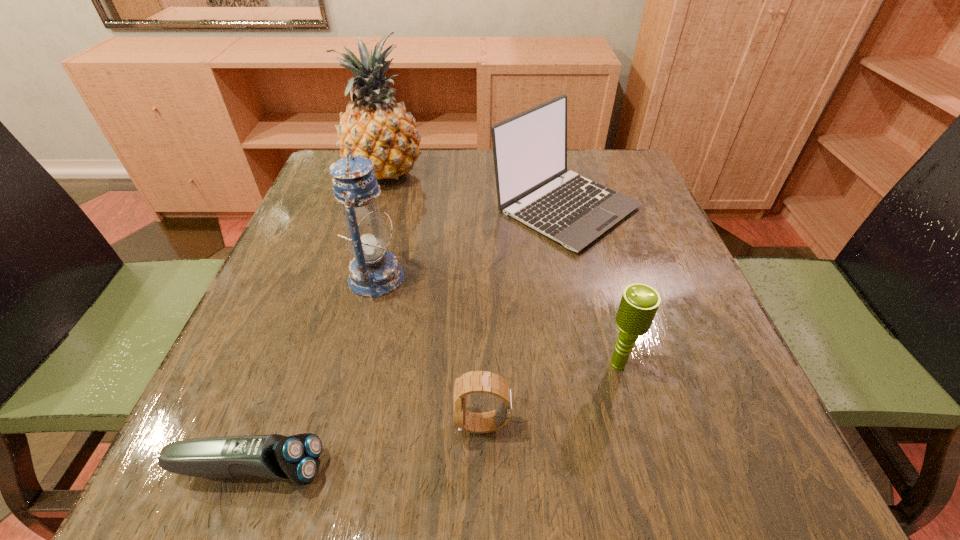
The image size is (960, 540). I want to click on free space that satisfies the following two spatial constraints: 1. on the front side of the microphone; 2. on the face of the fifth farthest object, so click(635, 424).

You are a GUI agent. You are given a task and a screenshot of the screen. Output one action in this format:
    pyautogui.click(x=<x>, y=<y>)
    Task: Click on the free region that satisfies the following two spatial constraints: 1. at the front screen of the microphone; 2. on the left side of the laptop_computer
    Image resolution: width=960 pixels, height=540 pixels.
    Given the screenshot: What is the action you would take?
    pyautogui.click(x=602, y=364)

You are a GUI agent. You are given a task and a screenshot of the screen. Output one action in this format:
    pyautogui.click(x=<x>, y=<y>)
    Task: Click on the free spot that satisfies the following two spatial constraints: 1. at the front screen of the fourth shortest object; 2. on the left side of the microphone
    This screenshot has height=540, width=960.
    Given the screenshot: What is the action you would take?
    pyautogui.click(x=602, y=364)

Image resolution: width=960 pixels, height=540 pixels. What are the coordinates of `vacant region that satisfies the following two spatial constraints: 1. at the front screen of the laptop_computer; 2. on the left side of the microphone` in the screenshot? It's located at (602, 364).

You are a GUI agent. You are given a task and a screenshot of the screen. Output one action in this format:
    pyautogui.click(x=<x>, y=<y>)
    Task: Click on the free space that satisfies the following two spatial constraints: 1. on the front-facing side of the fifth shortest object; 2. on the right side of the fourth farthest object
    
    Given the screenshot: What is the action you would take?
    pyautogui.click(x=355, y=364)

Identify the location of free location that satisfies the following two spatial constraints: 1. on the front-facing side of the microphone; 2. on the right side of the lantern. The image size is (960, 540). (355, 364).